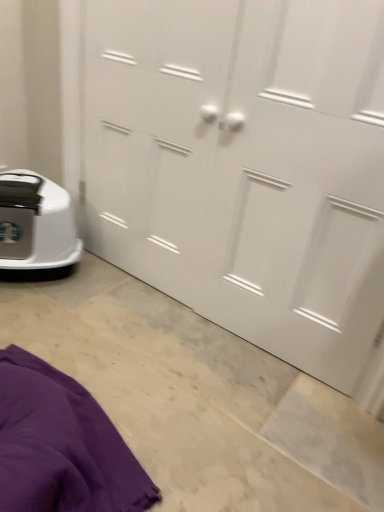
Locate an element on the screen. Image resolution: width=384 pixels, height=512 pixels. white matte door at center is located at coordinates click(245, 165).

In order to face purple fabric at lower left, should I rotate leftwards or rightwards?

Turn left approximately 19.073 degrees to face it.

Describe the element at coordinates (61, 445) in the screenshot. I see `purple fabric at lower left` at that location.

The image size is (384, 512). What are the coordinates of `white matte door at center` in the screenshot? It's located at (245, 165).

Between white plastic robot vacuum at lower left and white matte door at center, which one has smaller width?

white matte door at center is thinner.

Considering the relative positions of white plastic robot vacuum at lower left and white matte door at center in the image provided, is white plastic robot vacuum at lower left to the left of white matte door at center from the viewer's perspective?

Correct, you'll find white plastic robot vacuum at lower left to the left of white matte door at center.

From the image's perspective, is white plastic robot vacuum at lower left positioned above or below white matte door at center?

From the image's perspective, white plastic robot vacuum at lower left appears below white matte door at center.

I want to click on home appliance directly beneath the white matte door at center (from a real-world perspective), so click(x=36, y=226).

Considering the relative sizes of white plastic robot vacuum at lower left and purple fabric at lower left in the image provided, is white plastic robot vacuum at lower left smaller than purple fabric at lower left?

Yes, white plastic robot vacuum at lower left is smaller than purple fabric at lower left.

From a real-world perspective, is white plastic robot vacuum at lower left located beneath purple fabric at lower left?

Incorrect, from a real-world perspective, white plastic robot vacuum at lower left is higher than purple fabric at lower left.

Is white plastic robot vacuum at lower left to the left of purple fabric at lower left from the viewer's perspective?

Yes.

Is purple fabric at lower left oriented towards white matte door at center?

No, purple fabric at lower left is not oriented towards white matte door at center.

Is the position of purple fabric at lower left more distant than that of white matte door at center?

No, purple fabric at lower left is in front of white matte door at center.

Does purple fabric at lower left have a lesser width compared to white matte door at center?

In fact, purple fabric at lower left might be wider than white matte door at center.

From the picture: Is purple fabric at lower left not inside white matte door at center?

That's correct, purple fabric at lower left is outside of white matte door at center.

From a real-world perspective, who is located lower, white matte door at center or white plastic robot vacuum at lower left?

white plastic robot vacuum at lower left, from a real-world perspective.

Where is `door in front of the white plastic robot vacuum at lower left`? The height and width of the screenshot is (512, 384). door in front of the white plastic robot vacuum at lower left is located at coordinates (245, 165).

Relative to white plastic robot vacuum at lower left, is white matte door at center in front or behind?

white matte door at center is positioned closer to the viewer than white plastic robot vacuum at lower left.

From their relative heights in the image, would you say white matte door at center is taller or shorter than purple fabric at lower left?

Clearly, white matte door at center is taller compared to purple fabric at lower left.

From the image's perspective, would you say white matte door at center is shown under purple fabric at lower left?

No, from the image's perspective, white matte door at center is not beneath purple fabric at lower left.

Is white matte door at center wider or thinner than purple fabric at lower left?

Clearly, white matte door at center has less width compared to purple fabric at lower left.

From the picture: Is purple fabric at lower left taller or shorter than white plastic robot vacuum at lower left?

Considering their sizes, purple fabric at lower left has less height than white plastic robot vacuum at lower left.

Considering the positions of objects purple fabric at lower left and white plastic robot vacuum at lower left in the image provided, who is more to the left, purple fabric at lower left or white plastic robot vacuum at lower left?

Positioned to the left is white plastic robot vacuum at lower left.

Would you say purple fabric at lower left is outside white plastic robot vacuum at lower left?

purple fabric at lower left is positioned outside white plastic robot vacuum at lower left.

I want to click on blanket that appears below the white plastic robot vacuum at lower left (from the image's perspective), so click(61, 445).

Find the location of a particular element. This screenshot has height=512, width=384. door in front of the white plastic robot vacuum at lower left is located at coordinates (245, 165).

The image size is (384, 512). I want to click on home appliance above the purple fabric at lower left (from a real-world perspective), so click(x=36, y=226).

Estimate the real-world distances between objects in this image. Which object is further from white plastic robot vacuum at lower left, white matte door at center or purple fabric at lower left?

purple fabric at lower left is positioned further to the anchor white plastic robot vacuum at lower left.

Which object lies further to the anchor point purple fabric at lower left, white plastic robot vacuum at lower left or white matte door at center?

white matte door at center lies further to purple fabric at lower left than the other object.

From the image, which object appears to be nearer to white matte door at center, white plastic robot vacuum at lower left or purple fabric at lower left?

white plastic robot vacuum at lower left lies closer to white matte door at center than the other object.

Looking at the image, which one is located further to purple fabric at lower left, white matte door at center or white plastic robot vacuum at lower left?

Based on the image, white matte door at center appears to be further to purple fabric at lower left.

Which object lies further to the anchor point white plastic robot vacuum at lower left, purple fabric at lower left or white matte door at center?

purple fabric at lower left is further to white plastic robot vacuum at lower left.

In the scene shown: Estimate the real-world distances between objects in this image. Which object is further from white matte door at center, purple fabric at lower left or white plastic robot vacuum at lower left?

purple fabric at lower left is positioned further to the anchor white matte door at center.

At what (x,y) coordinates should I click in order to perform the action: click on door located between purple fabric at lower left and white plastic robot vacuum at lower left in the depth direction. Please return your answer as a coordinate pair (x, y). Looking at the image, I should click on (x=245, y=165).